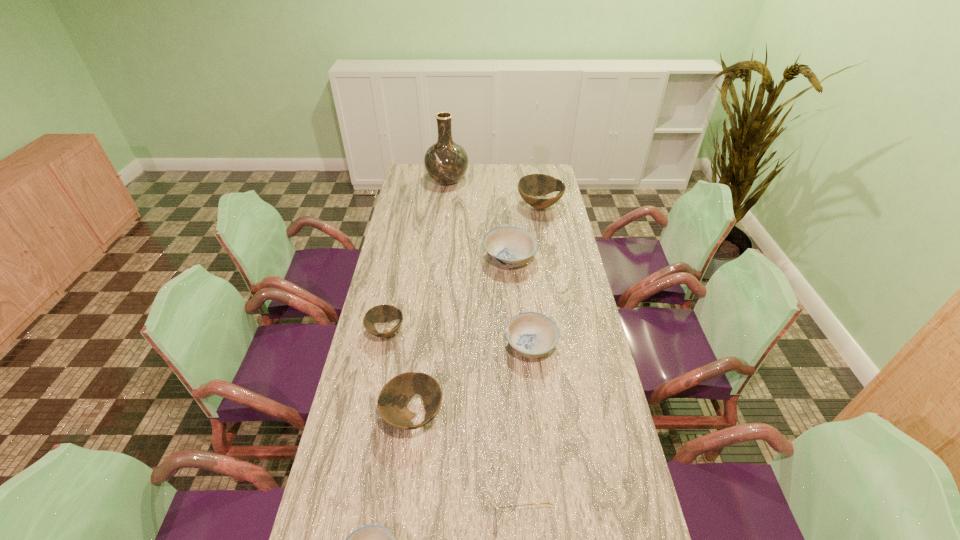
This screenshot has width=960, height=540. In order to click on free space at the left edge of the desktop in this screenshot , I will do `click(422, 258)`.

Identify the location of free space at the right edge of the desktop. (560, 330).

Where is `unoccupied position between the biggest brown bowl and the second biggest blue bowl`? This screenshot has height=540, width=960. unoccupied position between the biggest brown bowl and the second biggest blue bowl is located at coordinates (535, 276).

Where is `vacant space that is in between the second nearest brown bowl and the nearest brown bowl`? vacant space that is in between the second nearest brown bowl and the nearest brown bowl is located at coordinates (399, 374).

Identify the location of vacant point located between the tallest object and the second biggest brown bowl. (430, 299).

Locate an element on the screen. The image size is (960, 540). object that stands as the sixth closest to the smallest blue bowl is located at coordinates (534, 185).

Locate an element on the screen. The image size is (960, 540). the sixth closest object to the gold spectacles is located at coordinates (534, 185).

Where is `bowl that is the sixth closest to the farthest object`? bowl that is the sixth closest to the farthest object is located at coordinates (372, 539).

Choose which bowl is the second nearest neighbor to the gold spectacles. Please provide its 2D coordinates. Your answer should be formatted as a tuple, i.e. [(x, y)], where the tuple contains the x and y coordinates of a point satisfying the conditions above.

[(392, 402)]

Identify which brown bowl is located as the nearest to the second farthest bowl. Please provide its 2D coordinates. Your answer should be formatted as a tuple, i.e. [(x, y)], where the tuple contains the x and y coordinates of a point satisfying the conditions above.

[(534, 185)]